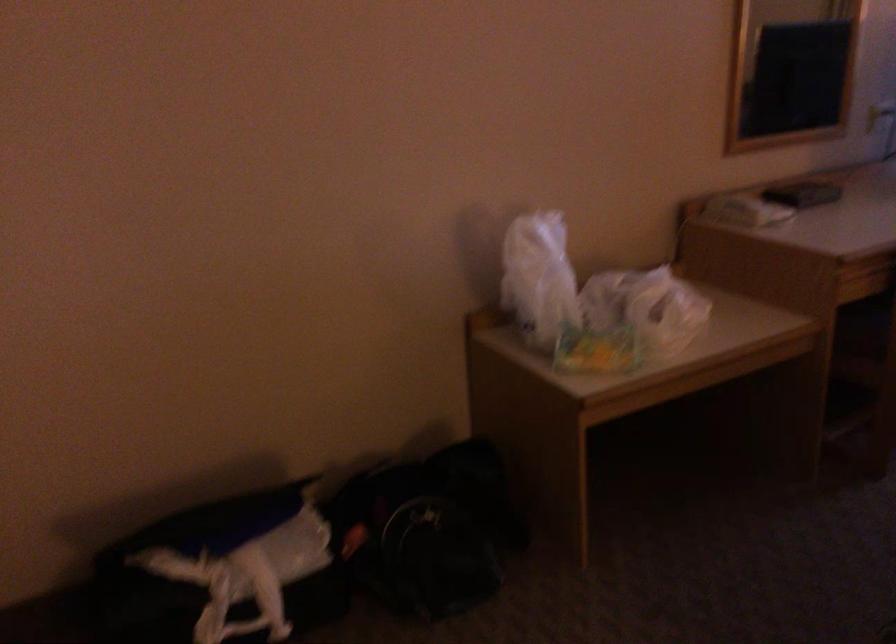
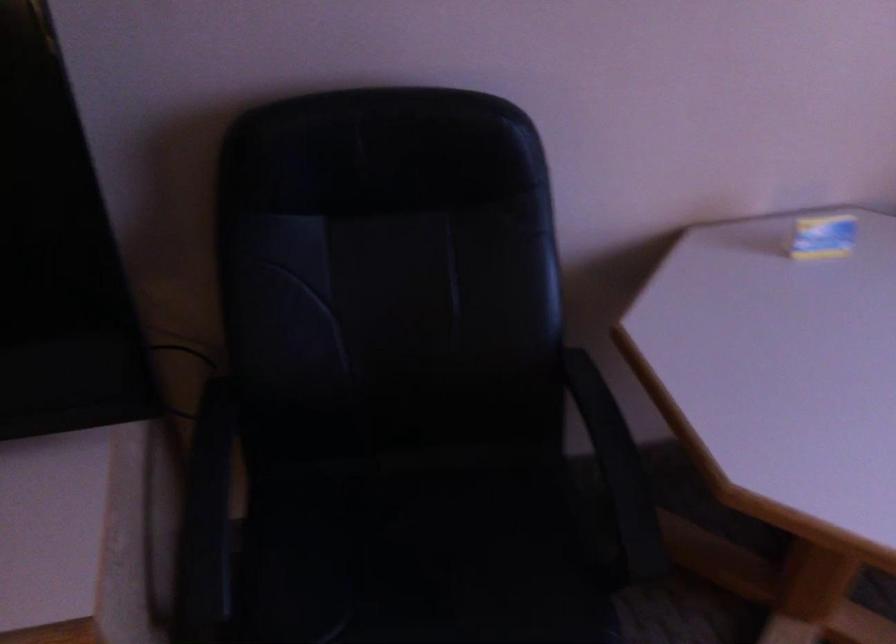
What movement of the cameraman would produce the second image?

The cameraman walked toward right, forward.